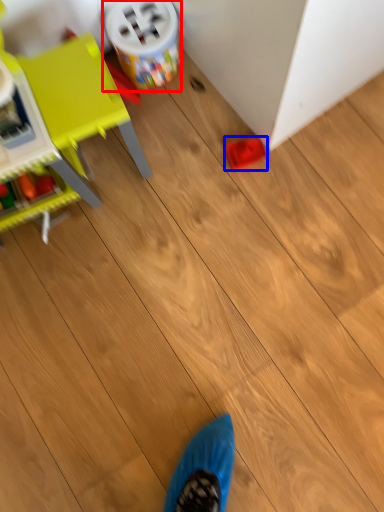
Question: Which object appears closest to the camera in this image, toy (highlighted by a red box) or toy (highlighted by a blue box)?

Choices:
 (A) toy
 (B) toy

Answer: (A)